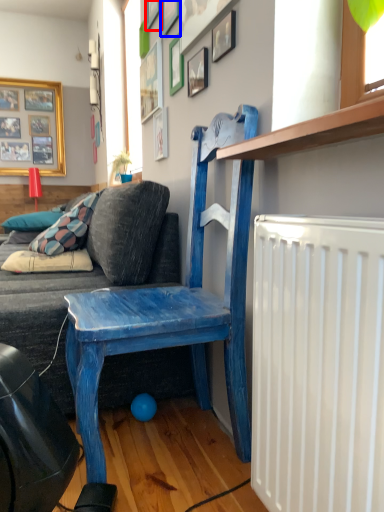
Question: Which of the following is the closest to the observer, picture frame (highlighted by a red box) or picture frame (highlighted by a blue box)?

Choices:
 (A) picture frame
 (B) picture frame

Answer: (B)